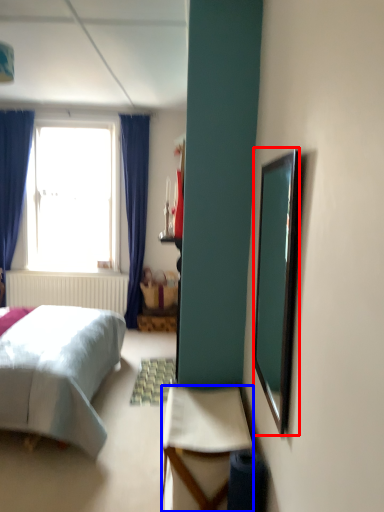
Question: Which of the following is the farthest to the observer, mirror (highlighted by a red box) or desk (highlighted by a blue box)?

Choices:
 (A) mirror
 (B) desk

Answer: (B)